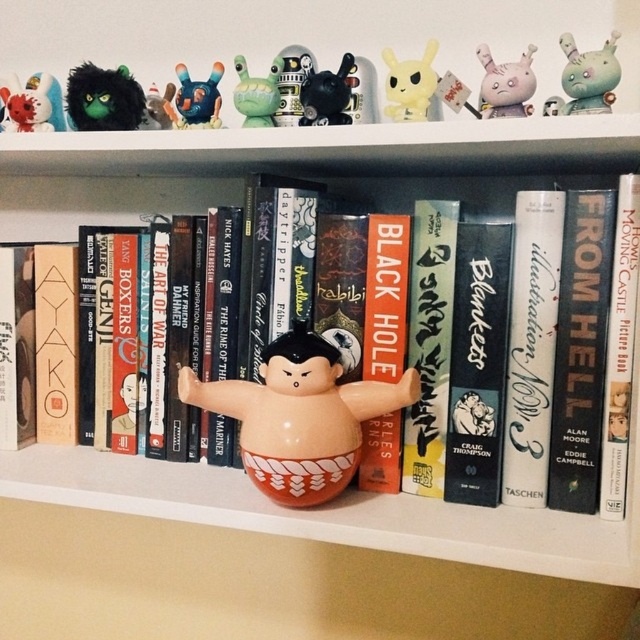
Is shiny black plush toy at upper left below matte white figurine at upper left?

No.

Measure the distance between point (80, 81) and camera.

Point (80, 81) and camera are 26.68 inches apart.

What do you see at coordinates (104, 99) in the screenshot? Image resolution: width=640 pixels, height=640 pixels. I see `shiny black plush toy at upper left` at bounding box center [104, 99].

The image size is (640, 640). Identify the location of shiny black plush toy at upper left. (104, 99).

Looking at this image, who is higher up, shiny black plush toy at upper left or blue rubber toy at upper center?

Positioned higher is shiny black plush toy at upper left.

Who is taller, shiny black plush toy at upper left or blue rubber toy at upper center?

shiny black plush toy at upper left is taller.

Locate an element on the screen. Image resolution: width=640 pixels, height=640 pixels. shiny black plush toy at upper left is located at coordinates (104, 99).

At what (x,y) coordinates should I click in order to perform the action: click on shiny black plush toy at upper left. Please return your answer as a coordinate pair (x, y). Looking at the image, I should click on (104, 99).

Can you confirm if glossy ceramic sumo wrestler at center is bigger than matte plastic rabbit at upper right?

Indeed, glossy ceramic sumo wrestler at center has a larger size compared to matte plastic rabbit at upper right.

Measure the distance between glossy ceramic sumo wrestler at center and matte plastic rabbit at upper right.

They are 13.01 inches apart.

What do you see at coordinates (100, 202) in the screenshot? I see `glossy ceramic sumo wrestler at center` at bounding box center [100, 202].

Find the location of a particular element. Image resolution: width=640 pixels, height=640 pixels. glossy ceramic sumo wrestler at center is located at coordinates (100, 202).